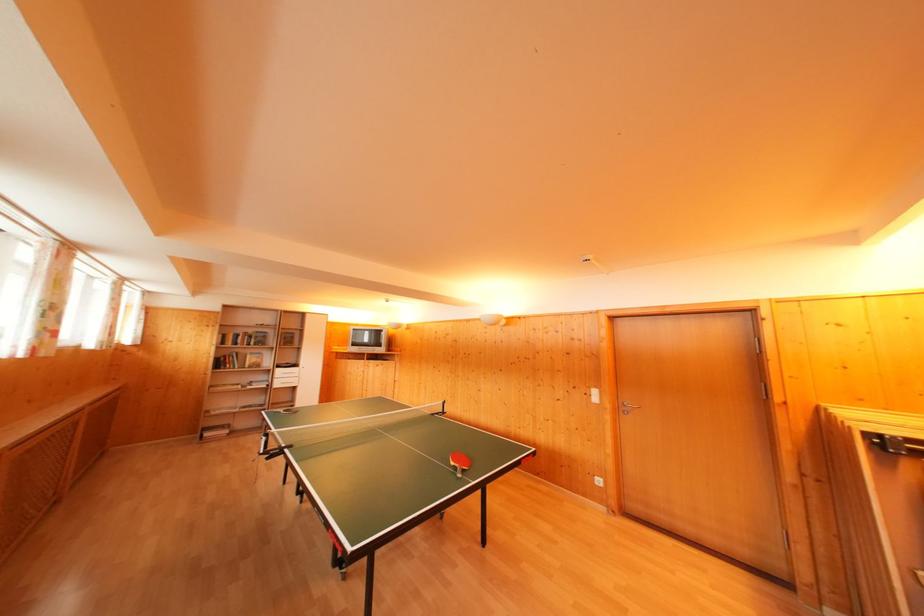
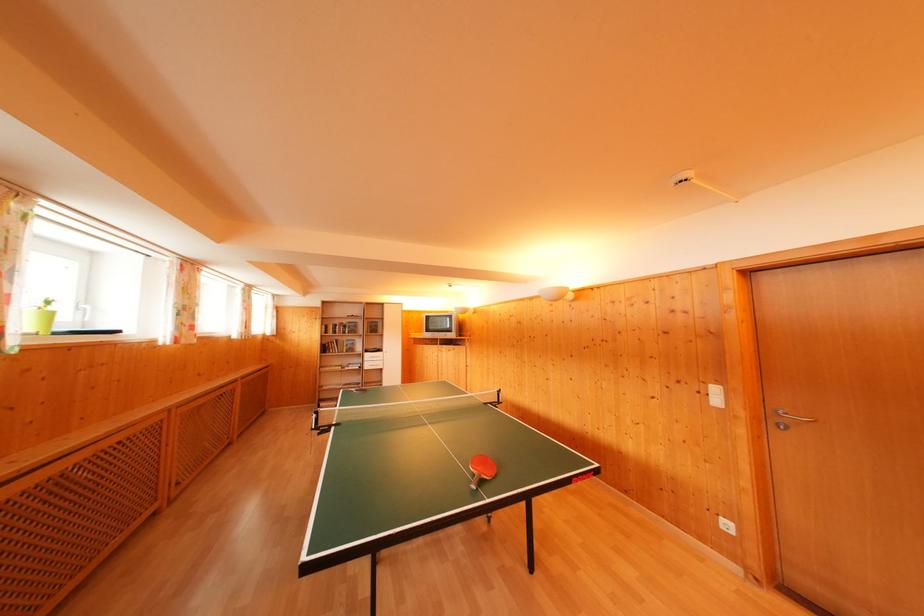
Where in the second image is the point corresponding to (x=223, y=353) from the first image?

(326, 342)